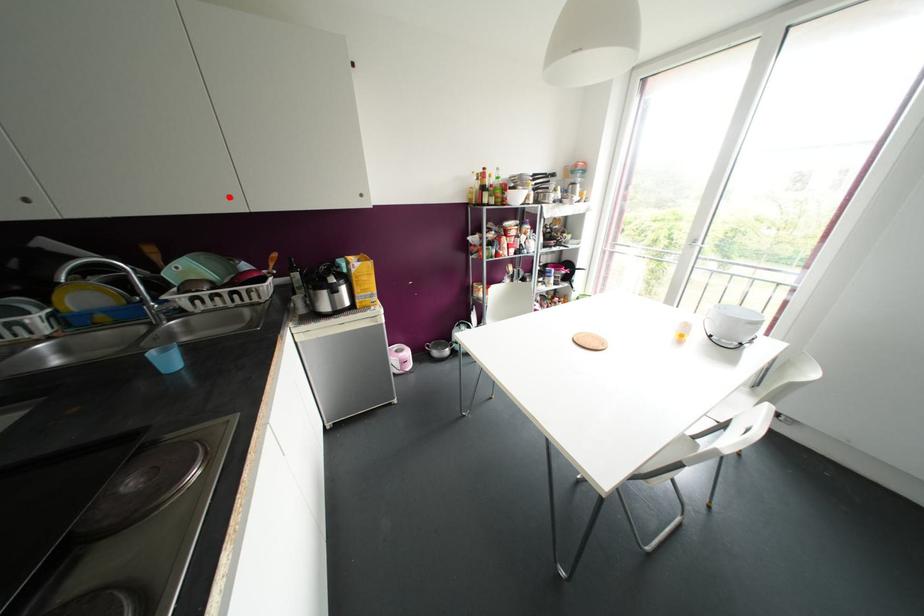
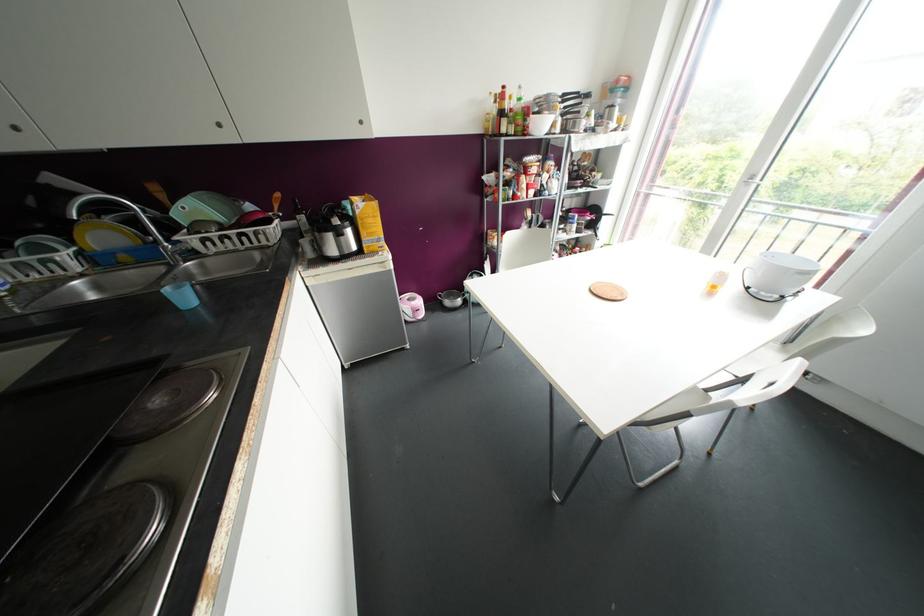
Question: I am providing you with two images of the same scene from different viewpoints. A red point is marked on the first image. At the location where the point appears in image 1, is it still visible in image 2?

Choices:
 (A) Yes
 (B) No

Answer: (A)